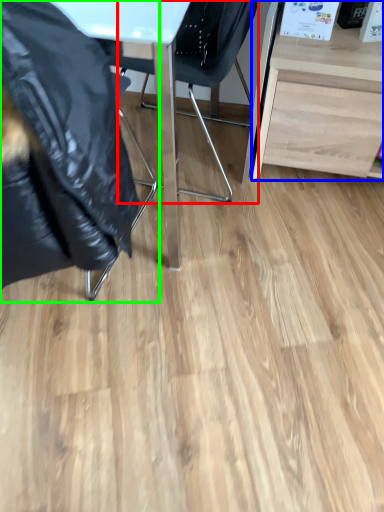
Question: Based on their relative distances, which object is nearer to chair (highlighted by a red box)? Choose from desk (highlighted by a blue box) and chair (highlighted by a green box).

Choices:
 (A) desk
 (B) chair

Answer: (A)